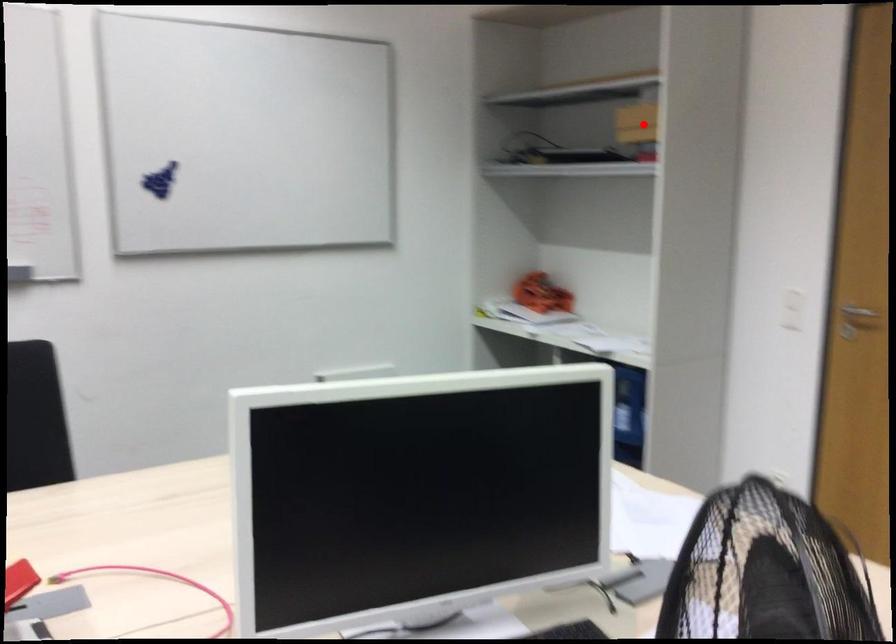
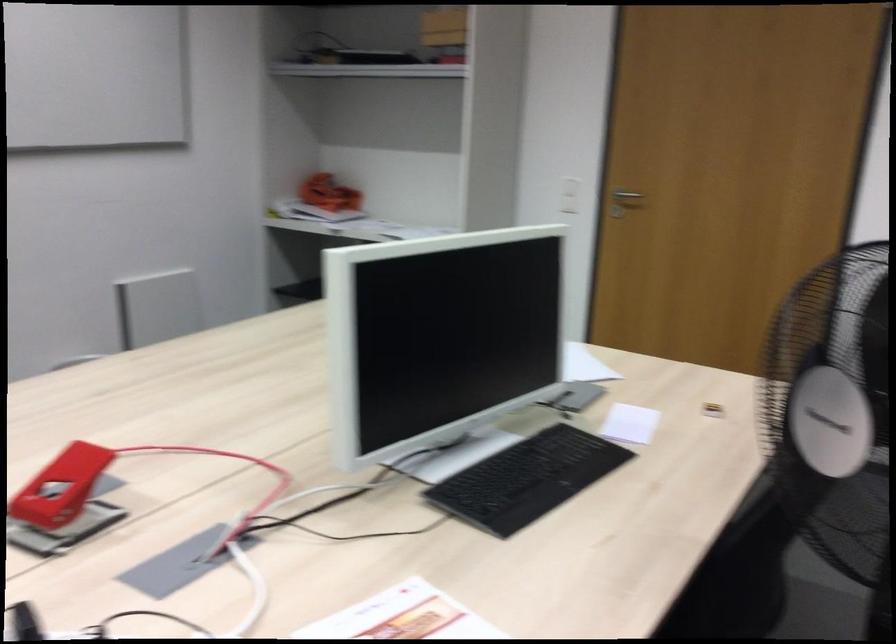
Where in the second image is the point corresponding to the highlighted location from the first image?

(444, 26)